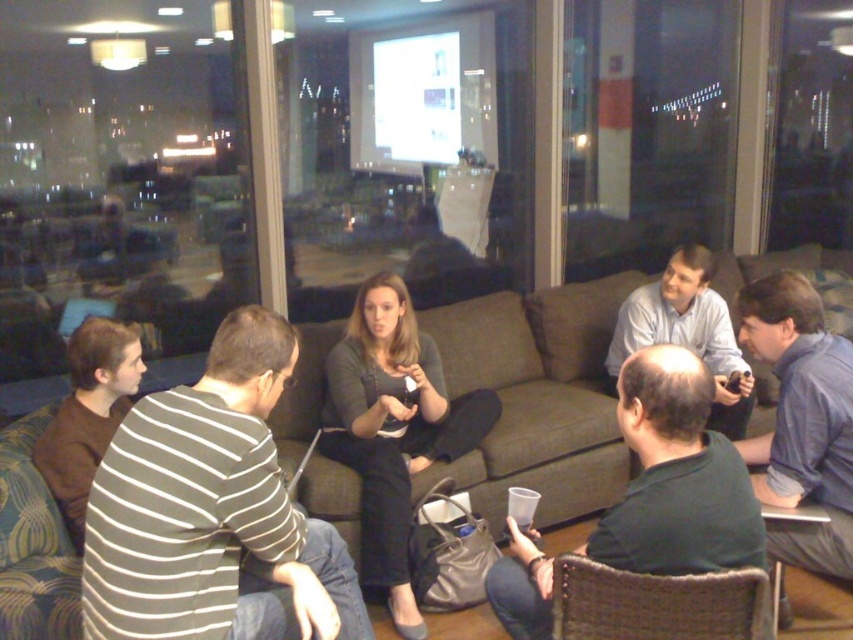
Who is more distant from viewer, (59,634) or (103,355)?

The point (103,355) is more distant.

Based on the photo, can you confirm if brown fabric couch at center is taller than brown cotton shirt at left?

Yes, brown fabric couch at center is taller than brown cotton shirt at left.

Does point (625, 472) lie in front of point (120, 378)?

No, it is not.

Where is `brown fabric couch at center`? This screenshot has width=853, height=640. brown fabric couch at center is located at coordinates (537, 397).

Between dark green t-shirt at center and light blue shirt at center, which one has more height?

light blue shirt at center is taller.

Does dark green t-shirt at center have a larger size compared to light blue shirt at center?

Actually, dark green t-shirt at center might be smaller than light blue shirt at center.

Identify the location of dark green t-shirt at center. (676, 477).

Can you confirm if dark gray sweater at center is taller than brown cotton shirt at left?

Yes.

Which is below, dark gray sweater at center or brown cotton shirt at left?

dark gray sweater at center is below.

Which is behind, point (413, 320) or point (57, 504)?

The point (413, 320) is more distant.

Where is `dark gray sweater at center`? Image resolution: width=853 pixels, height=640 pixels. dark gray sweater at center is located at coordinates (393, 429).